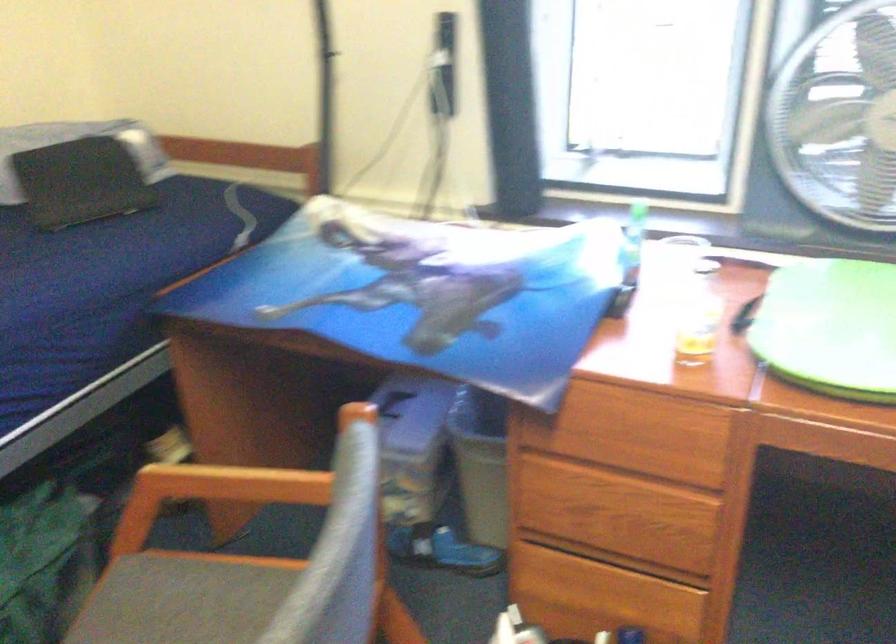
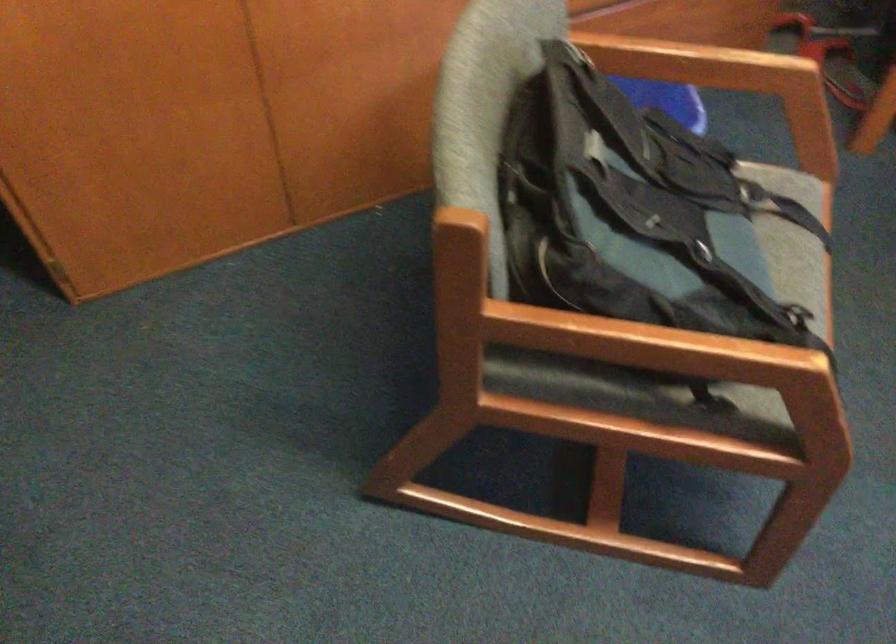
The images are taken continuously from a first-person perspective. In which direction is your viewpoint rotating?

The camera's rotation is toward left-down.